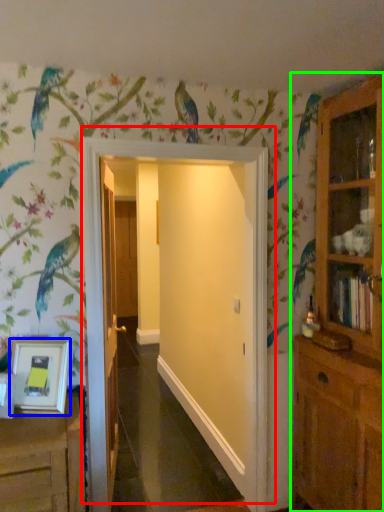
Question: Considering the real-world distances, which object is closest to door (highlighted by a red box)? picture frame (highlighted by a blue box) or cupboard (highlighted by a green box).

Choices:
 (A) picture frame
 (B) cupboard

Answer: (A)